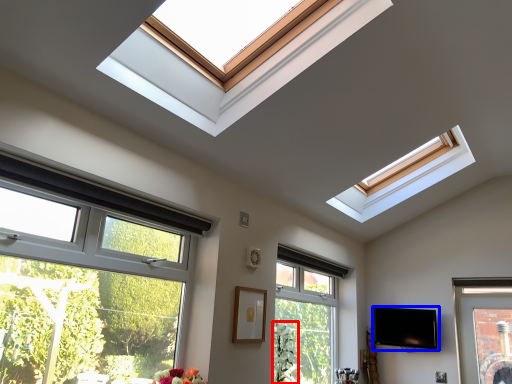
Question: Which of the following is the closest to the observer, plant (highlighted by a red box) or television (highlighted by a blue box)?

Choices:
 (A) plant
 (B) television

Answer: (A)